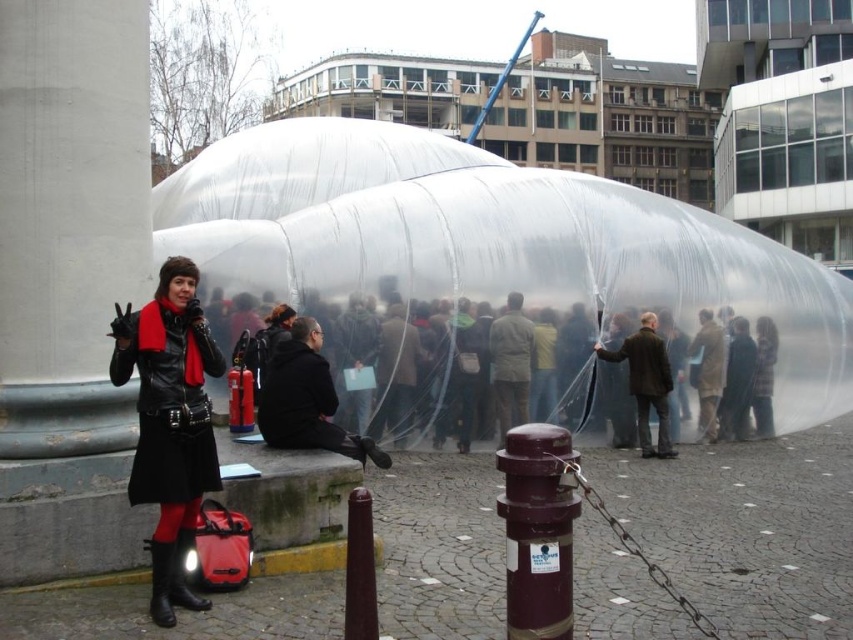
Question: Which point appears closest to the camera in this image?

Choices:
 (A) (151, 548)
 (B) (194, 604)

Answer: (B)

Question: Considering the relative positions of matte black coat at center and black leather boot at lower left in the image provided, where is matte black coat at center located with respect to black leather boot at lower left?

Choices:
 (A) above
 (B) below

Answer: (A)

Question: Which point appears closest to the camera in this image?

Choices:
 (A) (721, 340)
 (B) (558, 531)
 (C) (192, 608)
 (D) (538, 282)

Answer: (B)

Question: Which point is closer to the camera?

Choices:
 (A) (428, 387)
 (B) (572, 536)
 (C) (167, 620)

Answer: (B)

Question: Is matte black coat at center in front of shiny black boot at lower left?

Choices:
 (A) yes
 (B) no

Answer: (B)

Question: Does matte black coat at left have a lesser width compared to shiny black boot at lower left?

Choices:
 (A) no
 (B) yes

Answer: (A)